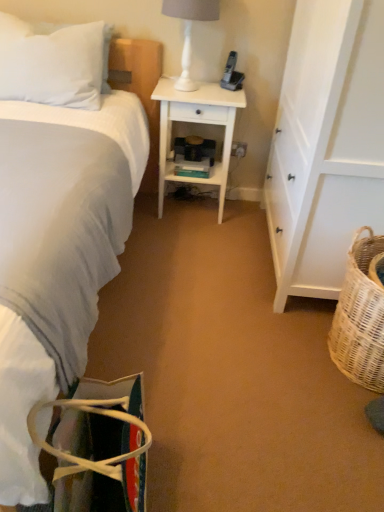
Where is `free space between white wood desk at center and woven wicker basket at lower right`? Image resolution: width=384 pixels, height=512 pixels. free space between white wood desk at center and woven wicker basket at lower right is located at coordinates (242, 273).